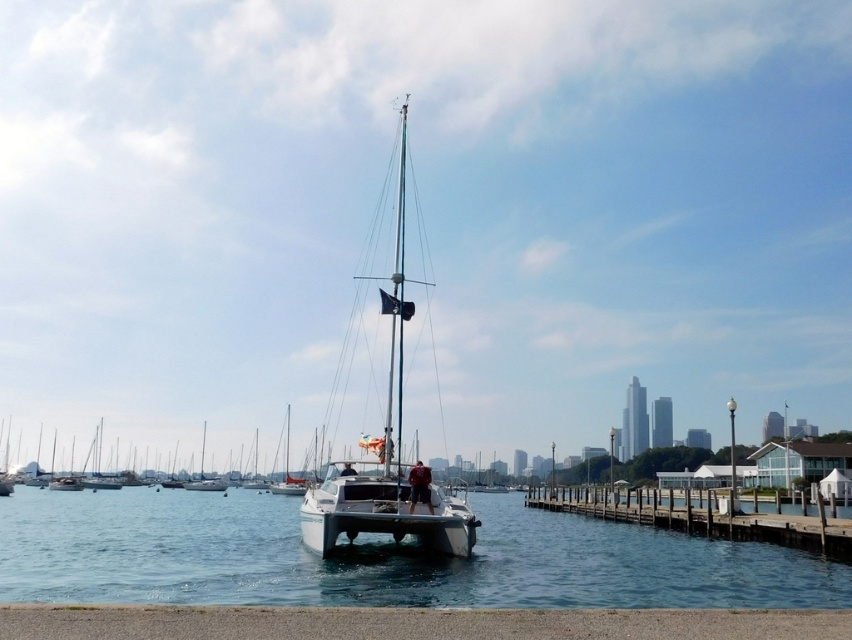
You are standing on the dock and want to reach the point marked at coordinates point [396,243]. The path to this point is 64.26 feet long. If your walking speed is 3 feet per second, how many seconds will it take you to reach the point?

The point [396,243] is 64.26 feet away from the camera. At a walking speed of 3 feet per second, it will take 64.26 divided by 3, which is approximately 21.42 seconds to reach the point.

Consider the image. You are standing on the wooden dock near the catamaran and want to reach the point marked at coordinates (378, 557). Is this point located on the wooden dock or on the water?

The point at coordinates (378, 557) is on clear blue water at center, so it is located on the water, not the wooden dock.